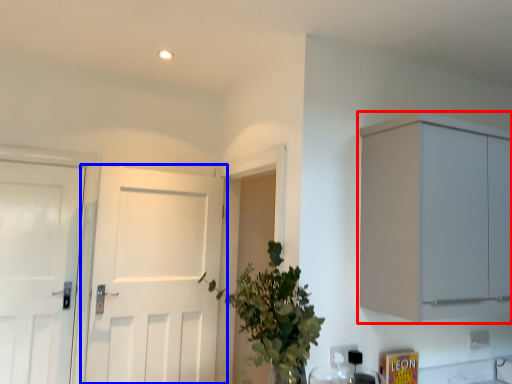
Question: Which object is closer to the camera taking this photo, cabinetry (highlighted by a red box) or door (highlighted by a blue box)?

Choices:
 (A) cabinetry
 (B) door

Answer: (A)